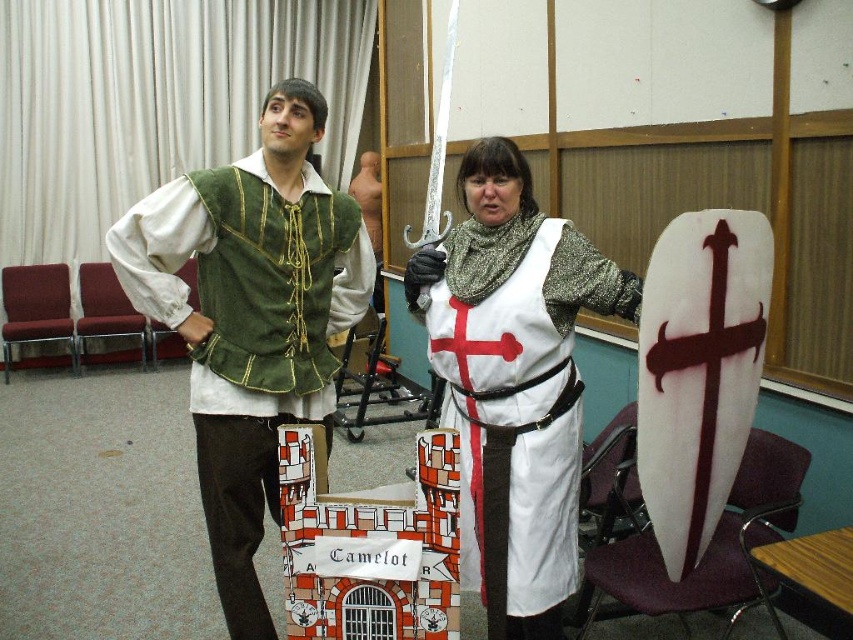
Question: In this image, where is green velvet vest at left located relative to white fabric with red cross at center?

Choices:
 (A) right
 (B) left

Answer: (B)

Question: In this image, where is green velvet vest at left located relative to white fabric with red cross at center?

Choices:
 (A) left
 (B) right

Answer: (A)

Question: Is green velvet vest at left bigger than white fabric with red cross at center?

Choices:
 (A) no
 (B) yes

Answer: (B)

Question: Which point is farther to the camera?

Choices:
 (A) green velvet vest at left
 (B) white fabric with red cross at center

Answer: (A)